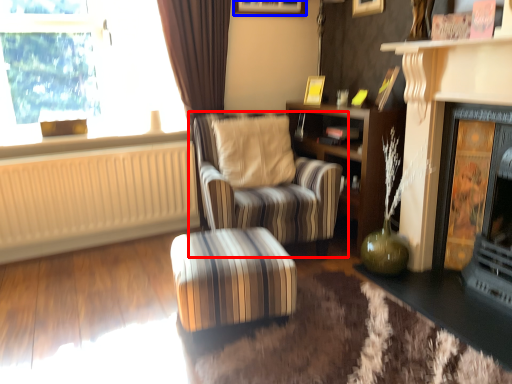
Question: Which point is closer to the camera, chair (highlighted by a red box) or picture frame (highlighted by a blue box)?

Choices:
 (A) chair
 (B) picture frame

Answer: (A)